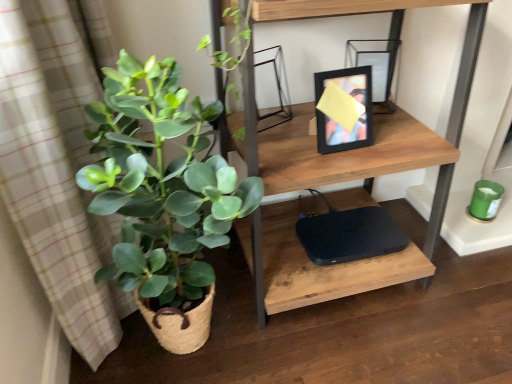
This screenshot has height=384, width=512. I want to click on free space in front of wooden shelf at upper center, so click(369, 349).